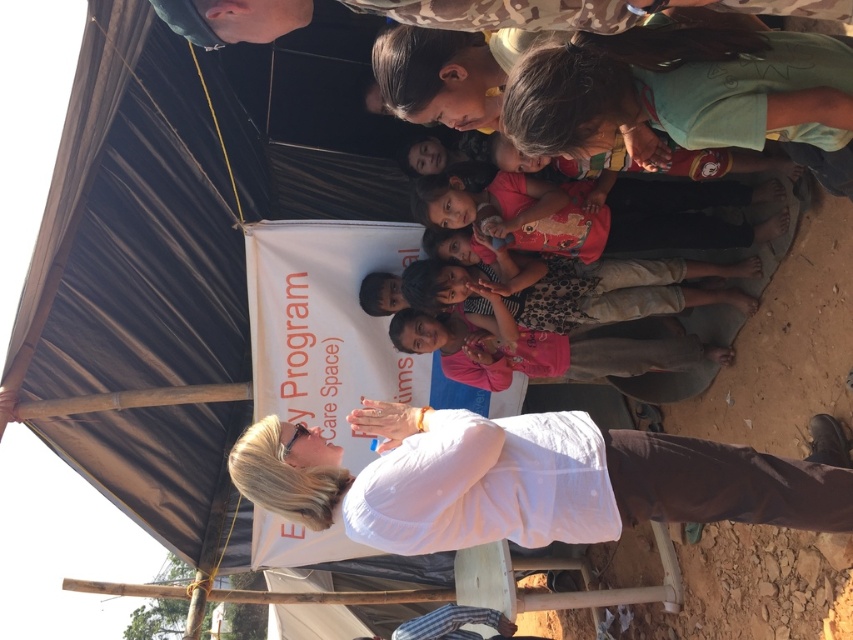
You are organizing a photo shoot and need to know which clothing item is wider for proper lighting setup. Which is wider between the white matte shirt at lower center and the pink fabric shirt at center?

The white matte shirt at lower center is wider than the pink fabric shirt at center according to the description.

You are standing in the crowd under the tent and want to locate the person wearing the matte pink shirt at center. Which direction should you look relative to the woman on the stool?

The matte pink shirt at center is located at point 0.342 on the x axis and 0.757 on the y axis. Since the woman is seated at the lower center, the person wearing the matte pink shirt at center is to the upper right of the woman on the stool.

You are a photographer trying to capture a clear shot of both the white matte shirt at lower center and the pink fabric shirt at center. Based on their sizes in the image, which one should you focus on first to ensure it fits within the frame?

The white matte shirt at lower center is taller than the pink fabric shirt at center, so you should focus on the white matte shirt at lower center first to ensure it fits within the frame.